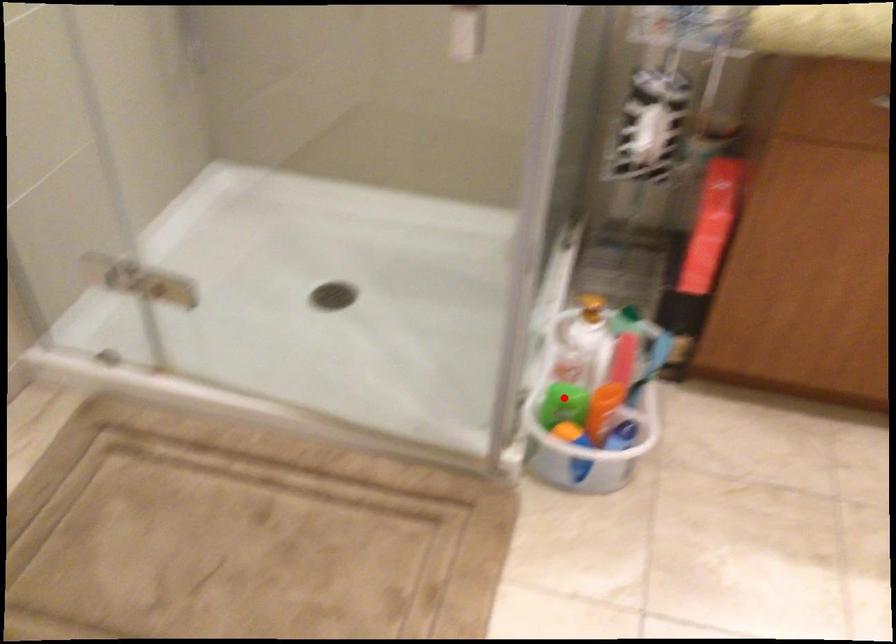
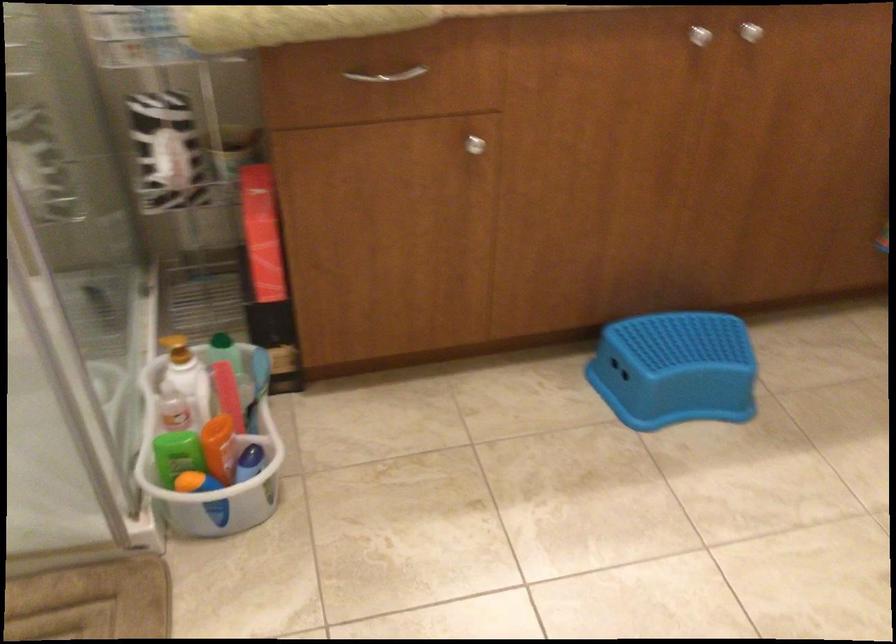
The point at the highlighted location is marked in the first image. Where is the corresponding point in the second image?

(177, 453)